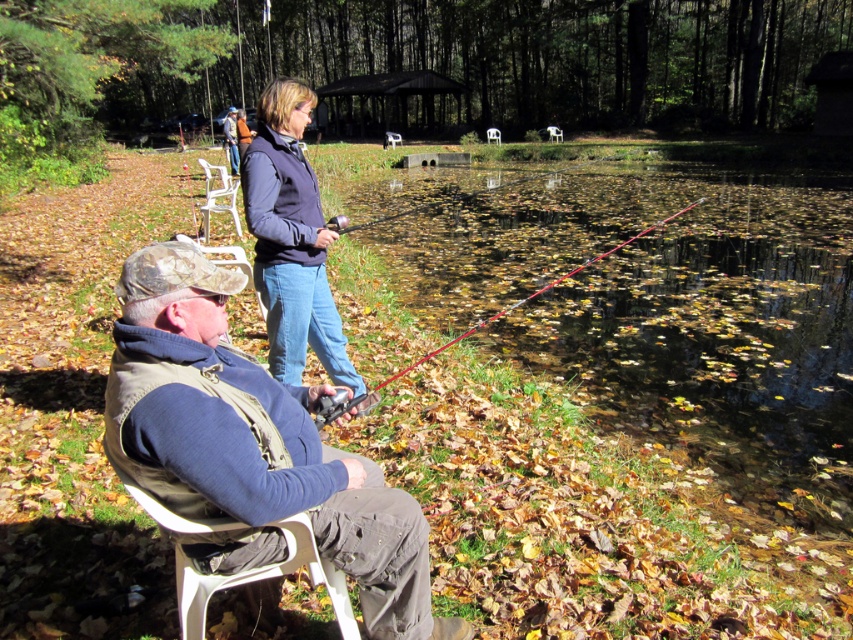
Is point (212, 445) farther from camera compared to point (527, 296)?

No.

Can you confirm if camouflage fabric hat at lower left is taller than red fiberglass rod at center?

No, camouflage fabric hat at lower left is not taller than red fiberglass rod at center.

Measure the distance between point (x=276, y=401) and camera.

Point (x=276, y=401) is 6.79 feet from camera.

In order to click on camouflage fabric hat at lower left in this screenshot , I will do `click(251, 445)`.

This screenshot has width=853, height=640. What do you see at coordinates (291, 240) in the screenshot?
I see `navy blue fleece at upper center` at bounding box center [291, 240].

Between point (297, 177) and point (590, 260), which one is positioned behind?

Positioned behind is point (590, 260).

What are the coordinates of `navy blue fleece at upper center` in the screenshot? It's located at (291, 240).

Between smooth plastic fishing pole at center and white plastic chair at upper center, which one appears on the right side from the viewer's perspective?

smooth plastic fishing pole at center is more to the right.

Which is in front, point (624, 154) or point (234, 225)?

Point (234, 225) is in front.

Locate an element on the screen. The width and height of the screenshot is (853, 640). smooth plastic fishing pole at center is located at coordinates (416, 209).

Identify the location of smooth plastic fishing pole at center. (416, 209).